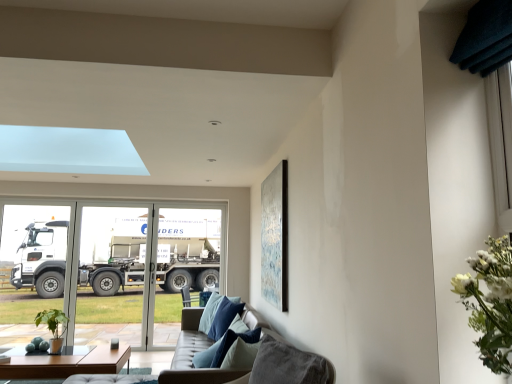
The height and width of the screenshot is (384, 512). I want to click on leather couch at lower center, so click(191, 357).

Where is `transparent glass screen door at left, the second screen door from the right`? Image resolution: width=512 pixels, height=384 pixels. transparent glass screen door at left, the second screen door from the right is located at coordinates (117, 274).

How much space does transparent glass screen door at left, marked as the 1th screen door in a left-to-right arrangement, occupy horizontally?

The width of transparent glass screen door at left, marked as the 1th screen door in a left-to-right arrangement, is 4.16 inches.

The width and height of the screenshot is (512, 384). What do you see at coordinates (207, 355) in the screenshot? I see `blue velvet pillow at center` at bounding box center [207, 355].

What do you see at coordinates (274, 237) in the screenshot? The height and width of the screenshot is (384, 512). I see `metallic silver picture frame at upper right` at bounding box center [274, 237].

What do you see at coordinates (67, 363) in the screenshot?
I see `matte black coffee table at lower left` at bounding box center [67, 363].

Describe the element at coordinates (53, 327) in the screenshot. I see `green matte plant at lower left` at that location.

The width and height of the screenshot is (512, 384). I want to click on green matte plant at lower left, so click(x=53, y=327).

This screenshot has width=512, height=384. In order to click on leather couch at lower center in this screenshot , I will do `click(191, 357)`.

Is white metallic truck at left spatially inside transparent glass screen door at center, the 1th screen door viewed from the right, or outside of it?

The correct answer is: outside.

What are the coordinates of `truck below the transparent glass screen door at center, the 2th screen door viewed from the left (from a real-world perspective)` in the screenshot? It's located at (188, 254).

Between white metallic truck at left and transparent glass screen door at center, the 2th screen door viewed from the left, which one has less height?

white metallic truck at left is shorter.

Considering the sizes of objects white metallic truck at left and transparent glass screen door at center, the 2th screen door viewed from the left, in the image provided, who is wider, white metallic truck at left or transparent glass screen door at center, the 2th screen door viewed from the left,?

With larger width is white metallic truck at left.

The height and width of the screenshot is (384, 512). In order to click on table that appears on the left of blue velvet pillow at center in this screenshot , I will do `click(67, 363)`.

From a real-world perspective, who is located lower, matte black coffee table at lower left or blue velvet pillow at center?

matte black coffee table at lower left, from a real-world perspective.

Is point (87, 359) closer or farther from the camera than point (204, 351)?

Clearly, point (87, 359) is more distant from the camera than point (204, 351).

From a real-world perspective, is transparent glass screen door at left, marked as the 1th screen door in a left-to-right arrangement, physically below transparent glass screen door at center, the 1th screen door viewed from the right?

Correct, in the physical world, transparent glass screen door at left, marked as the 1th screen door in a left-to-right arrangement, is lower than transparent glass screen door at center, the 1th screen door viewed from the right.

Does transparent glass screen door at left, the second screen door from the right, have a lesser height compared to transparent glass screen door at center, the 1th screen door viewed from the right?

Incorrect, the height of transparent glass screen door at left, the second screen door from the right, does not fall short of that of transparent glass screen door at center, the 1th screen door viewed from the right.

Can you confirm if transparent glass screen door at left, marked as the 1th screen door in a left-to-right arrangement, is positioned to the right of transparent glass screen door at center, the 1th screen door viewed from the right?

No.

Looking at the image, does blue velvet pillow at center seem bigger or smaller compared to matte black coffee table at lower left?

Considering their sizes, blue velvet pillow at center takes up less space than matte black coffee table at lower left.

How far apart are blue velvet pillow at center and matte black coffee table at lower left?

A distance of 3.99 feet exists between blue velvet pillow at center and matte black coffee table at lower left.

Based on the photo, between blue velvet pillow at center and matte black coffee table at lower left, which one appears on the right side from the viewer's perspective?

Positioned to the right is blue velvet pillow at center.

Is blue velvet pillow at center taller than matte black coffee table at lower left?

Correct, blue velvet pillow at center is much taller as matte black coffee table at lower left.

Is blue velvet pillow at center positioned with its back to transparent glass screen door at left, the second screen door from the right?

That's not correct — blue velvet pillow at center is not looking away from transparent glass screen door at left, the second screen door from the right.

Which object is positioned more to the left, blue velvet pillow at center or transparent glass screen door at left, the second screen door from the right?

From the viewer's perspective, transparent glass screen door at left, the second screen door from the right, appears more on the left side.

From a real-world perspective, which is physically above, blue velvet pillow at center or transparent glass screen door at left, marked as the 1th screen door in a left-to-right arrangement?

transparent glass screen door at left, marked as the 1th screen door in a left-to-right arrangement, is physically above.

Can you see blue velvet pillow at center touching transparent glass screen door at left, marked as the 1th screen door in a left-to-right arrangement?

blue velvet pillow at center and transparent glass screen door at left, marked as the 1th screen door in a left-to-right arrangement, are not in contact.

Can you confirm if leather couch at lower center is taller than white metallic truck at left?

In fact, leather couch at lower center may be shorter than white metallic truck at left.

Considering the positions of point (231, 374) and point (23, 276), is point (231, 374) closer or farther from the camera than point (23, 276)?

Point (231, 374).

Is white metallic truck at left at the back of leather couch at lower center?

Result: That's not correct — leather couch at lower center is not looking away from white metallic truck at left.

Considering the relative sizes of leather couch at lower center and white metallic truck at left in the image provided, is leather couch at lower center wider than white metallic truck at left?

Yes.

Between matte black coffee table at lower left and metallic silver picture frame at upper right, which one has larger size?

With larger size is matte black coffee table at lower left.

From the image's perspective, which one is positioned lower, matte black coffee table at lower left or metallic silver picture frame at upper right?

matte black coffee table at lower left is shown below in the image.

How far apart are matte black coffee table at lower left and metallic silver picture frame at upper right?

matte black coffee table at lower left and metallic silver picture frame at upper right are 1.87 meters apart from each other.

The height and width of the screenshot is (384, 512). I want to click on table that is behind the metallic silver picture frame at upper right, so click(x=67, y=363).

Find the location of a particular element. This screenshot has height=384, width=512. truck below the transparent glass screen door at center, the 1th screen door viewed from the right (from the image's perspective) is located at coordinates (188, 254).

Locate an element on the screen. This screenshot has width=512, height=384. pillow that appears on the right of matte black coffee table at lower left is located at coordinates (207, 355).

When comparing their distances from white metallic truck at left, does blue velvet pillow at center or metallic silver picture frame at upper right seem further?

blue velvet pillow at center.

Looking at the image, which one is located closer to leather couch at lower center, transparent glass screen door at left, the second screen door from the right, or metallic silver picture frame at upper right?

metallic silver picture frame at upper right lies closer to leather couch at lower center than the other object.

Based on their spatial positions, is leather couch at lower center or blue velvet pillow at center further from green matte plant at lower left?

blue velvet pillow at center is positioned further to the anchor green matte plant at lower left.

From the image, which object appears to be farther from matte black coffee table at lower left, transparent glass screen door at left, marked as the 1th screen door in a left-to-right arrangement, or green matte plant at lower left?

The object further to matte black coffee table at lower left is transparent glass screen door at left, marked as the 1th screen door in a left-to-right arrangement.

When comparing their distances from metallic silver picture frame at upper right, does white metallic truck at left or matte black coffee table at lower left seem further?

white metallic truck at left is positioned further to the anchor metallic silver picture frame at upper right.

From the picture: Looking at the image, which one is located closer to transparent glass screen door at left, marked as the 1th screen door in a left-to-right arrangement, transparent glass screen door at center, the 1th screen door viewed from the right, or metallic silver picture frame at upper right?

transparent glass screen door at center, the 1th screen door viewed from the right, is closer to transparent glass screen door at left, marked as the 1th screen door in a left-to-right arrangement.

Consider the image. Based on their spatial positions, is transparent glass screen door at center, the 1th screen door viewed from the right, or white metallic truck at left closer to green matte plant at lower left?

transparent glass screen door at center, the 1th screen door viewed from the right, is positioned closer to the anchor green matte plant at lower left.

Considering their positions, is leather couch at lower center positioned closer to green matte plant at lower left than transparent glass screen door at center, the 2th screen door viewed from the left?

transparent glass screen door at center, the 2th screen door viewed from the left, is positioned closer to the anchor green matte plant at lower left.

You are a GUI agent. You are given a task and a screenshot of the screen. Output one action in this format:
    pyautogui.click(x=<x>, y=<y>)
    Task: Click on the truck between transparent glass screen door at left, the second screen door from the right, and transparent glass screen door at center, the 2th screen door viewed from the left, in the horizontal direction
    The image size is (512, 384).
    Given the screenshot: What is the action you would take?
    pyautogui.click(x=188, y=254)

This screenshot has height=384, width=512. I want to click on truck between metallic silver picture frame at upper right and transparent glass screen door at center, the 1th screen door viewed from the right, in the front-back direction, so click(188, 254).

Identify the location of houseplant between white metallic truck at left and metallic silver picture frame at upper right. The width and height of the screenshot is (512, 384). (53, 327).

Find the location of a particular element. pillow between leather couch at lower center and transparent glass screen door at left, the second screen door from the right, in the front-back direction is located at coordinates (207, 355).